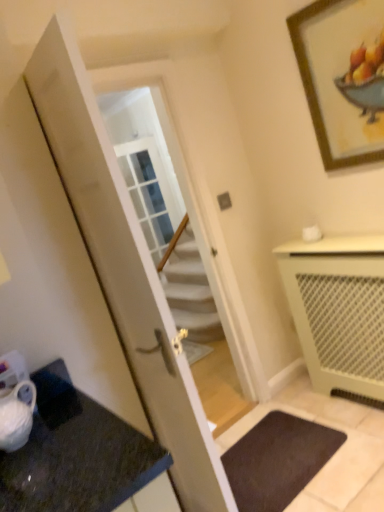
Question: Is dark brown carpet at lower center taller than white glossy door at center?

Choices:
 (A) no
 (B) yes

Answer: (A)

Question: Can you confirm if dark brown carpet at lower center is thinner than white glossy door at center?

Choices:
 (A) no
 (B) yes

Answer: (A)

Question: Does dark brown carpet at lower center have a lesser height compared to white glossy door at center?

Choices:
 (A) yes
 (B) no

Answer: (A)

Question: From the image's perspective, would you say dark brown carpet at lower center is positioned over white glossy door at center?

Choices:
 (A) no
 (B) yes

Answer: (A)

Question: From a real-world perspective, does dark brown carpet at lower center sit lower than white glossy door at center?

Choices:
 (A) yes
 (B) no

Answer: (A)

Question: Relative to wooden framed artwork at upper right, is white glossy door at center in front or behind?

Choices:
 (A) behind
 (B) front

Answer: (B)

Question: From a real-world perspective, is white glossy door at center physically located above or below wooden framed artwork at upper right?

Choices:
 (A) below
 (B) above

Answer: (A)

Question: In terms of width, does white glossy door at center look wider or thinner when compared to wooden framed artwork at upper right?

Choices:
 (A) wide
 (B) thin

Answer: (A)

Question: Is white glossy door at center taller or shorter than wooden framed artwork at upper right?

Choices:
 (A) tall
 (B) short

Answer: (A)

Question: From a real-world perspective, relative to white glossy door at center, is dark brown carpet at lower center vertically above or below?

Choices:
 (A) above
 (B) below

Answer: (B)

Question: Which is correct: dark brown carpet at lower center is inside white glossy door at center, or outside of it?

Choices:
 (A) inside
 (B) outside

Answer: (B)

Question: In terms of height, does dark brown carpet at lower center look taller or shorter compared to white glossy door at center?

Choices:
 (A) tall
 (B) short

Answer: (B)

Question: Considering the positions of dark brown carpet at lower center and white glossy door at center in the image, is dark brown carpet at lower center bigger or smaller than white glossy door at center?

Choices:
 (A) big
 (B) small

Answer: (B)

Question: Looking at the image, does dark brown carpet at lower center seem bigger or smaller compared to beige mesh radiator at lower right?

Choices:
 (A) big
 (B) small

Answer: (B)

Question: From a real-world perspective, relative to beige mesh radiator at lower right, is dark brown carpet at lower center vertically above or below?

Choices:
 (A) above
 (B) below

Answer: (B)